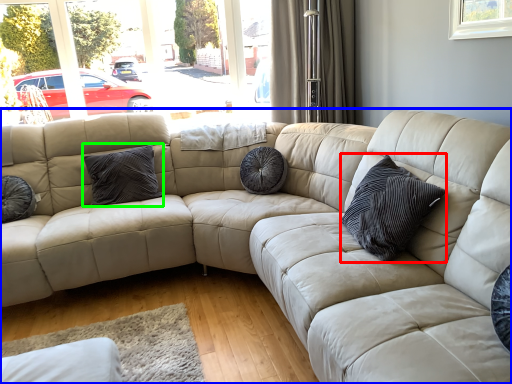
Question: Based on their relative distances, which object is farther from pillow (highlighted by a red box)? Choose from studio couch (highlighted by a blue box) and pillow (highlighted by a green box).

Choices:
 (A) studio couch
 (B) pillow

Answer: (B)